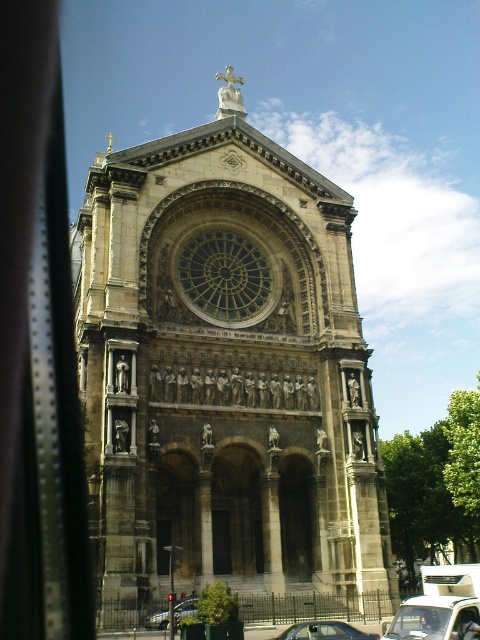
Question: Can you confirm if transparent glass car window at lower right is positioned above silver metallic car at lower center?

Choices:
 (A) yes
 (B) no

Answer: (A)

Question: Does transparent glass car window at lower right appear on the right side of metallic silver car at lower left?

Choices:
 (A) yes
 (B) no

Answer: (A)

Question: Which point is closer to the camera?

Choices:
 (A) (263, 289)
 (B) (433, 609)

Answer: (B)

Question: Among these points, which one is nearest to the camera?

Choices:
 (A) click(412, 605)
 (B) click(265, 481)

Answer: (A)

Question: Which point is farther to the camera?

Choices:
 (A) transparent glass car window at lower right
 (B) silver metallic car at lower center
 (C) stone cathedral at center
 (D) metallic silver car at lower left

Answer: (D)

Question: Considering the relative positions of stone cathedral at center and transparent glass car window at lower right in the image provided, where is stone cathedral at center located with respect to transparent glass car window at lower right?

Choices:
 (A) right
 (B) left

Answer: (B)